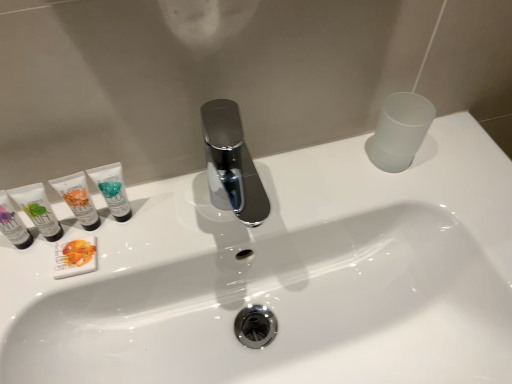
The width and height of the screenshot is (512, 384). Identify the location of unoccupied region to the right of matte white tube at left, the 4th toiletry from the right. (169, 227).